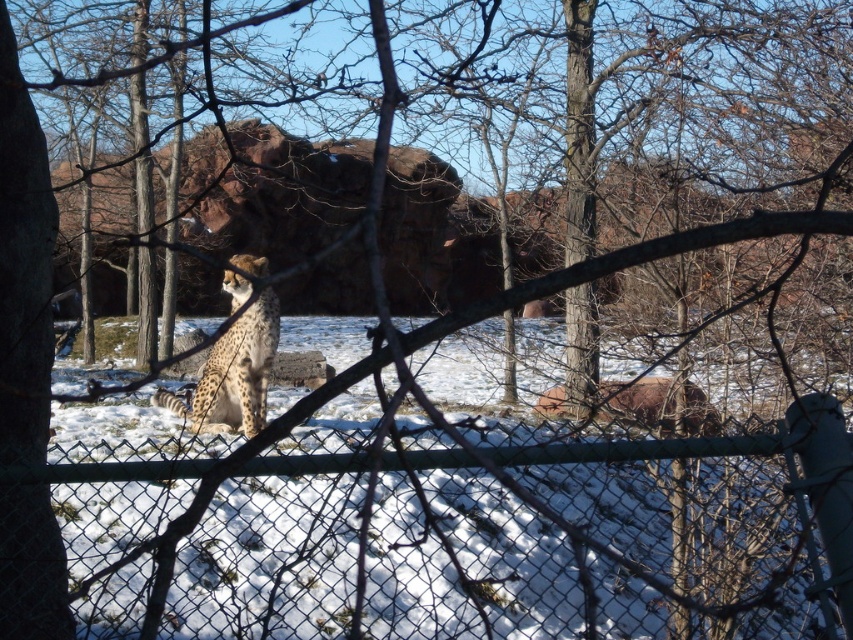
Is the position of green chain-link fence at center less distant than that of spotted fur cheetah at center?

That is True.

Can you confirm if green chain-link fence at center is bigger than spotted fur cheetah at center?

Yes, green chain-link fence at center is bigger than spotted fur cheetah at center.

Locate an element on the screen. green chain-link fence at center is located at coordinates (465, 538).